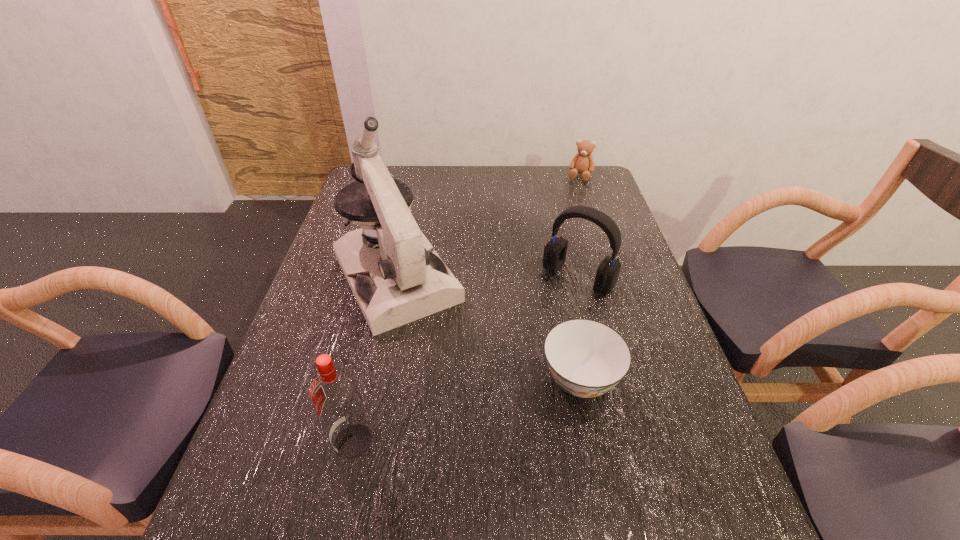
Where is `vodka`? The width and height of the screenshot is (960, 540). vodka is located at coordinates (334, 393).

Identify the location of the fourth shortest object. (334, 393).

This screenshot has height=540, width=960. Identify the location of the shortest object. (586, 358).

This screenshot has height=540, width=960. Find the location of `the fourth farthest object`. the fourth farthest object is located at coordinates (586, 358).

Locate an element on the screen. The width and height of the screenshot is (960, 540). headset is located at coordinates (554, 256).

Where is `the farthest object`? The height and width of the screenshot is (540, 960). the farthest object is located at coordinates (583, 163).

You are a GUI agent. You are given a task and a screenshot of the screen. Output one action in this format:
    pyautogui.click(x=<x>, y=<y>)
    Task: Click on the teddy bear
    
    Given the screenshot: What is the action you would take?
    pyautogui.click(x=583, y=163)

You are a GUI agent. You are given a task and a screenshot of the screen. Output one action in this format:
    pyautogui.click(x=<x>, y=<y>)
    Task: Click on the microscope
    This screenshot has height=540, width=960.
    Given the screenshot: What is the action you would take?
    coord(403,280)

Locate an element on the screen. This screenshot has height=540, width=960. blank space located on the front label of the second tallest object is located at coordinates (283, 442).

Where is `free spot located 0.110m on the front label of the second tallest object`? free spot located 0.110m on the front label of the second tallest object is located at coordinates (277, 442).